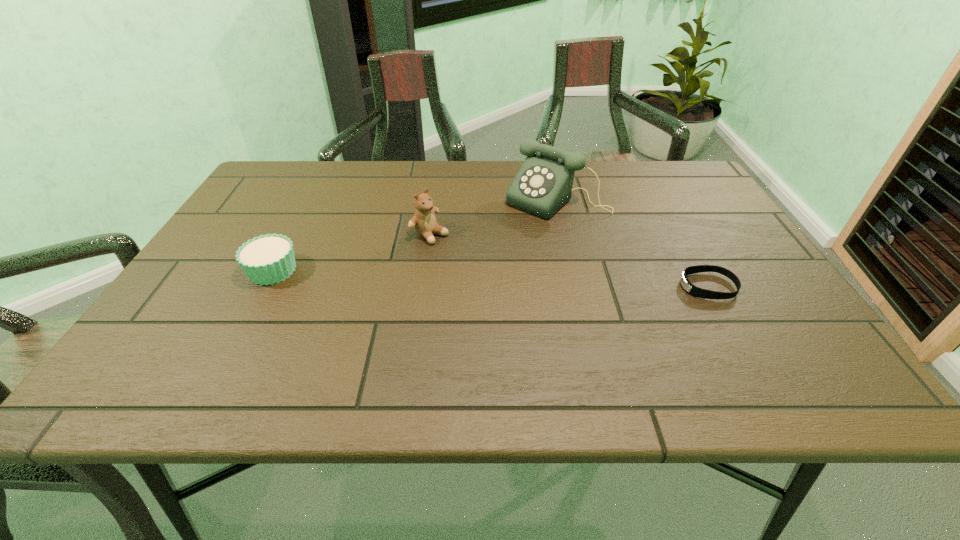
The image size is (960, 540). In order to click on free space that satisfies the following two spatial constraints: 1. on the front side of the farthest object; 2. on the display of the rightmost object in this screenshot , I will do pyautogui.click(x=579, y=286).

In order to click on vacant region that satisfies the following two spatial constraints: 1. on the back side of the third nearest object; 2. on the left side of the leftmost object in this screenshot , I will do `click(292, 234)`.

The image size is (960, 540). Find the location of `vacant region that satisfies the following two spatial constraints: 1. on the back side of the third nearest object; 2. on the left side of the second object from right to left`. vacant region that satisfies the following two spatial constraints: 1. on the back side of the third nearest object; 2. on the left side of the second object from right to left is located at coordinates (435, 200).